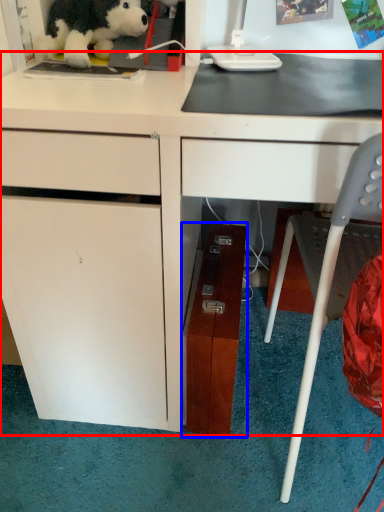
Question: Which object appears farthest to the camera in this image, desk (highlighted by a red box) or file cabinet (highlighted by a blue box)?

Choices:
 (A) desk
 (B) file cabinet

Answer: (B)